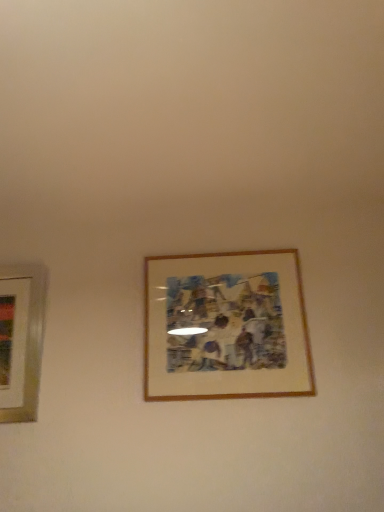
Question: Is matte white picture frame at left, which ranks as the second picture frame in right-to-left order, completely or partially inside wooden-framed artwork at center, which is counted as the second picture frame, starting from the left?

Choices:
 (A) yes
 (B) no

Answer: (B)

Question: Is wooden-framed artwork at center, acting as the 1th picture frame starting from the right, thinner than matte white picture frame at left, the first picture frame viewed from the left?

Choices:
 (A) no
 (B) yes

Answer: (B)

Question: Is the depth of wooden-framed artwork at center, which is counted as the second picture frame, starting from the left, less than that of matte white picture frame at left, the first picture frame viewed from the left?

Choices:
 (A) yes
 (B) no

Answer: (A)

Question: Does wooden-framed artwork at center, acting as the 1th picture frame starting from the right, touch matte white picture frame at left, the first picture frame viewed from the left?

Choices:
 (A) yes
 (B) no

Answer: (B)

Question: From a real-world perspective, is wooden-framed artwork at center, acting as the 1th picture frame starting from the right, over matte white picture frame at left, which ranks as the second picture frame in right-to-left order?

Choices:
 (A) no
 (B) yes

Answer: (B)

Question: Does wooden-framed artwork at center, which is counted as the second picture frame, starting from the left, have a larger size compared to matte white picture frame at left, which ranks as the second picture frame in right-to-left order?

Choices:
 (A) no
 (B) yes

Answer: (B)

Question: Does matte white picture frame at left, which ranks as the second picture frame in right-to-left order, have a smaller size compared to wooden-framed artwork at center, which is counted as the second picture frame, starting from the left?

Choices:
 (A) yes
 (B) no

Answer: (A)

Question: Considering the relative positions of matte white picture frame at left, the first picture frame viewed from the left, and wooden-framed artwork at center, acting as the 1th picture frame starting from the right, in the image provided, is matte white picture frame at left, the first picture frame viewed from the left, to the right of wooden-framed artwork at center, acting as the 1th picture frame starting from the right, from the viewer's perspective?

Choices:
 (A) no
 (B) yes

Answer: (A)

Question: Could you tell me if matte white picture frame at left, which ranks as the second picture frame in right-to-left order, is facing wooden-framed artwork at center, which is counted as the second picture frame, starting from the left?

Choices:
 (A) yes
 (B) no

Answer: (B)

Question: Are matte white picture frame at left, which ranks as the second picture frame in right-to-left order, and wooden-framed artwork at center, acting as the 1th picture frame starting from the right, far apart?

Choices:
 (A) no
 (B) yes

Answer: (A)

Question: Does matte white picture frame at left, which ranks as the second picture frame in right-to-left order, have a greater width compared to wooden-framed artwork at center, acting as the 1th picture frame starting from the right?

Choices:
 (A) yes
 (B) no

Answer: (A)

Question: From a real-world perspective, is matte white picture frame at left, which ranks as the second picture frame in right-to-left order, physically below wooden-framed artwork at center, which is counted as the second picture frame, starting from the left?

Choices:
 (A) no
 (B) yes

Answer: (B)

Question: From a real-world perspective, is matte white picture frame at left, the first picture frame viewed from the left, physically located above or below wooden-framed artwork at center, which is counted as the second picture frame, starting from the left?

Choices:
 (A) below
 (B) above

Answer: (A)